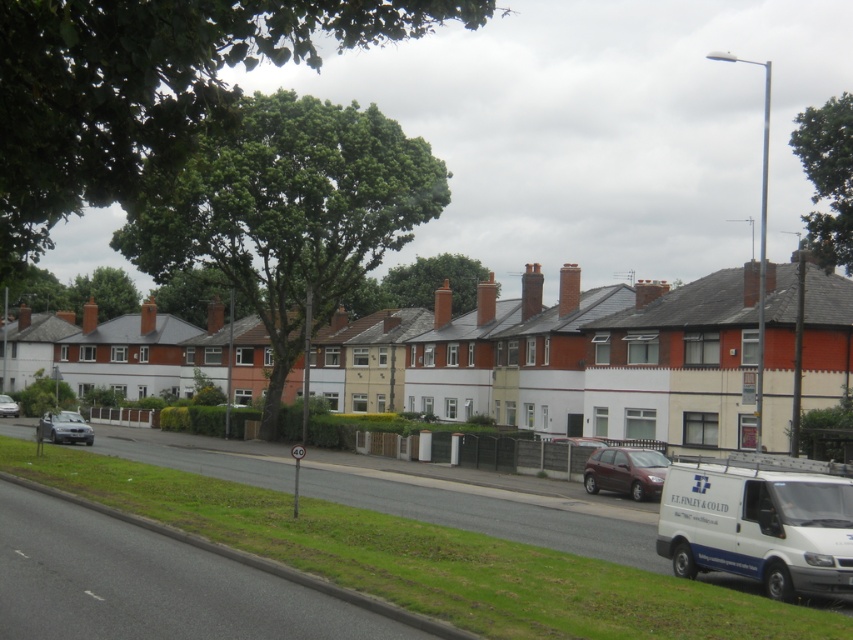
Question: Which of the following is the farthest from the observer?

Choices:
 (A) (51, 436)
 (B) (668, 528)

Answer: (A)

Question: Can you confirm if maroon matte hatchback at center is positioned to the right of shiny silver car at lower left?

Choices:
 (A) yes
 (B) no

Answer: (A)

Question: Based on their relative distances, which object is farther from the green grass at lower left?

Choices:
 (A) white matte van at lower right
 (B) silver metallic car at left
 (C) shiny silver car at lower left

Answer: (B)

Question: From the image, what is the correct spatial relationship of maroon matte hatchback at center in relation to shiny silver car at lower left?

Choices:
 (A) right
 (B) left

Answer: (A)

Question: Which point is farther to the camera?

Choices:
 (A) shiny silver car at lower left
 (B) silver metallic car at left
 (C) maroon matte hatchback at center
 (D) green grass at lower left

Answer: (B)

Question: Observing the image, what is the correct spatial positioning of white matte van at lower right in reference to maroon matte hatchback at center?

Choices:
 (A) above
 (B) below

Answer: (A)